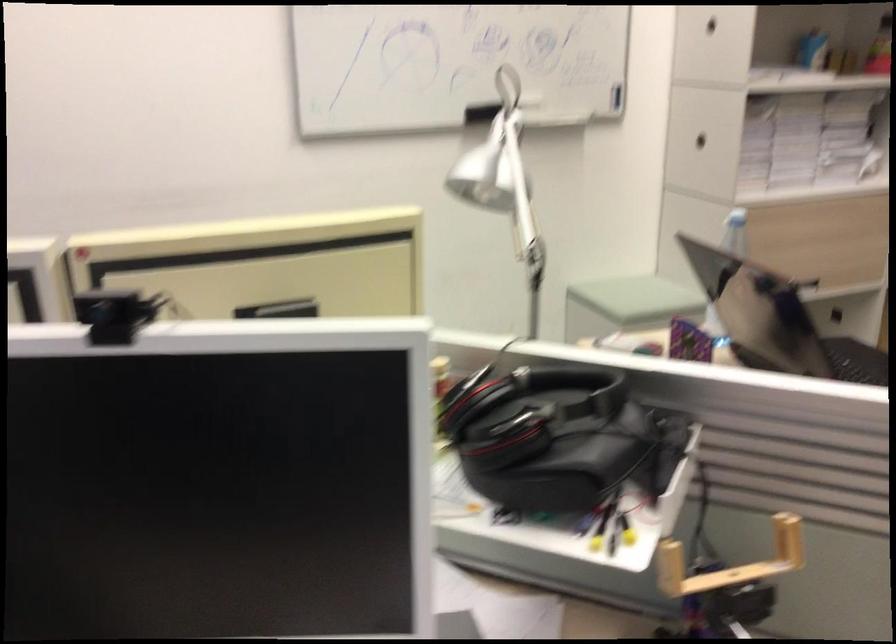
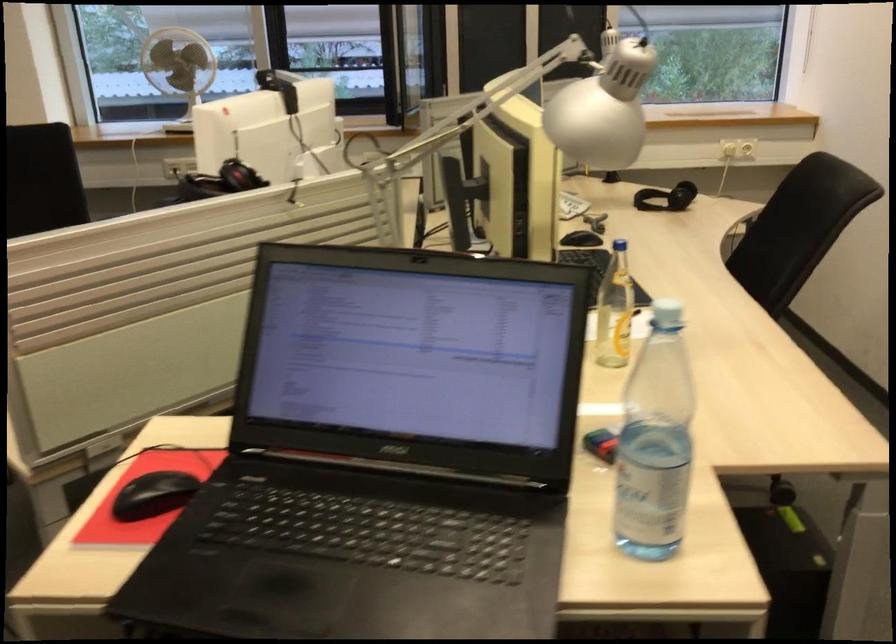
Locate, in the second image, the point that corresponds to (x=380, y=306) in the first image.

(618, 245)